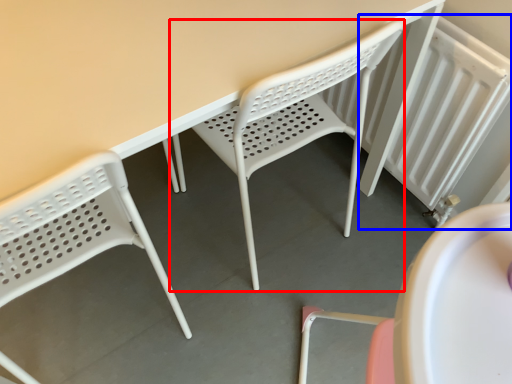
Question: Which of the following is the closest to the observer, chair (highlighted by a red box) or radiator (highlighted by a blue box)?

Choices:
 (A) chair
 (B) radiator

Answer: (A)